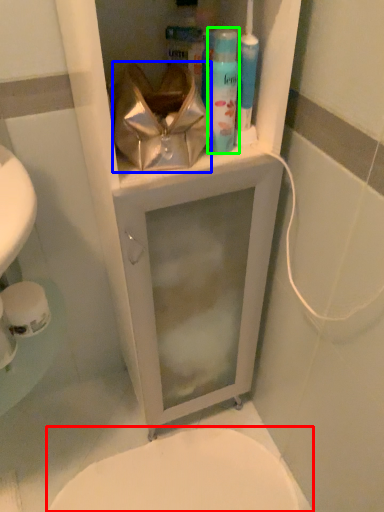
Question: Which object is the farthest from bidet (highlighted by a red box)? Choose among these: pouch (highlighted by a blue box) or shaving cream (highlighted by a green box).

Choices:
 (A) pouch
 (B) shaving cream

Answer: (B)